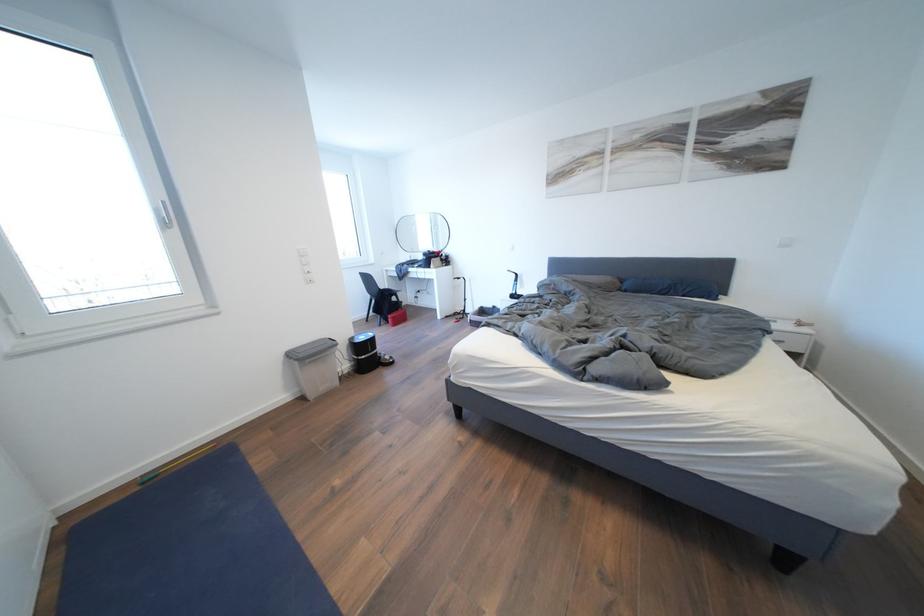
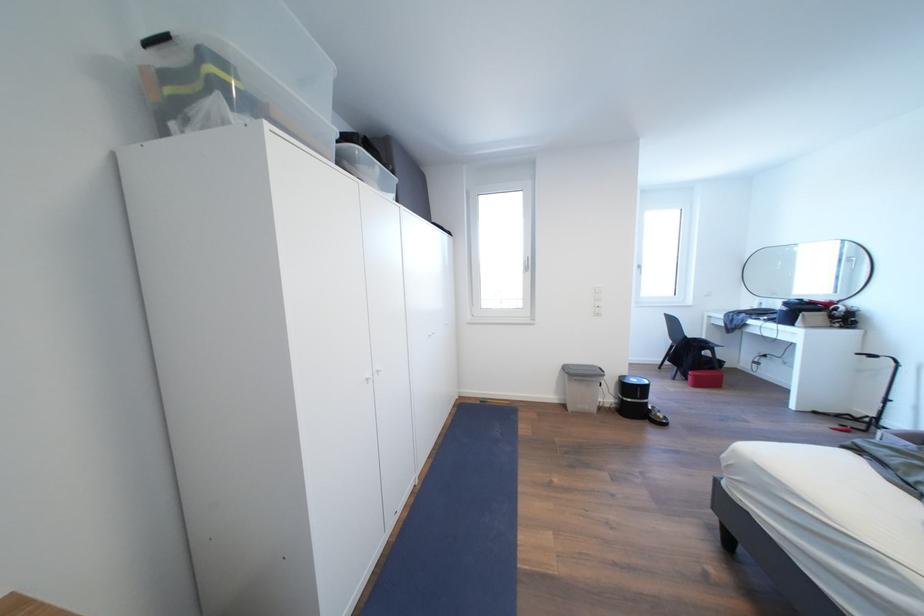
Where in the second image is the point corresponding to (x=310, y=361) from the first image?

(579, 377)